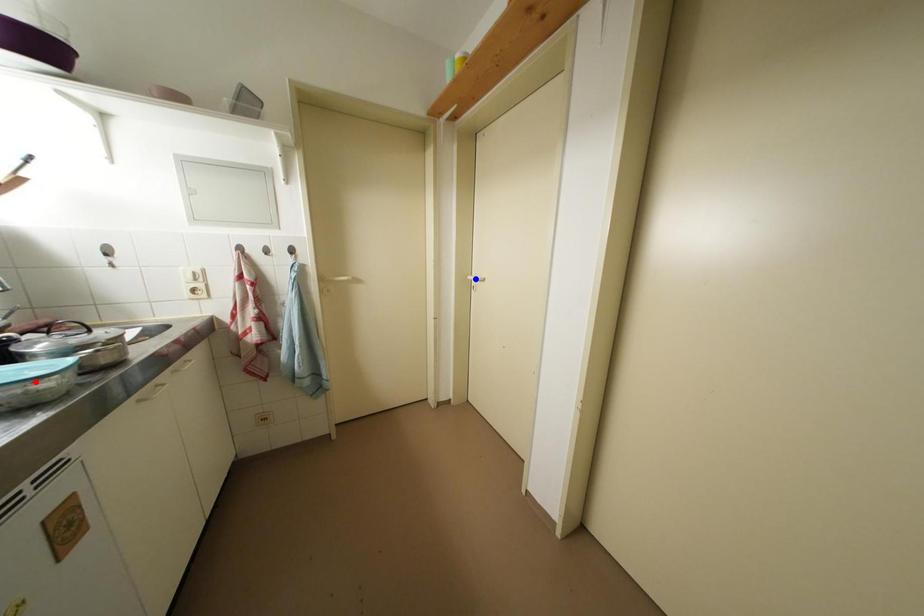
Question: In the image, two points are highlighted. Which point is nearer to the camera? Reply with the corresponding letter.

Choices:
 (A) blue point
 (B) red point

Answer: (B)